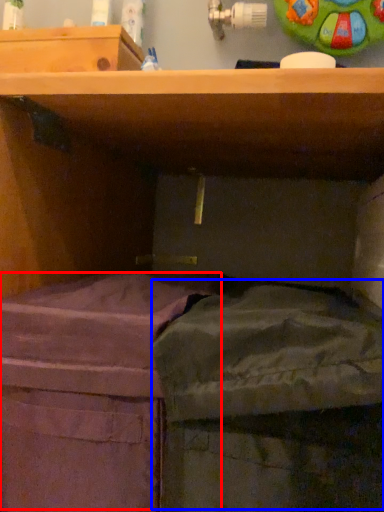
Question: Which object is closer to the camera taking this photo, wide (highlighted by a red box) or wide (highlighted by a blue box)?

Choices:
 (A) wide
 (B) wide

Answer: (B)